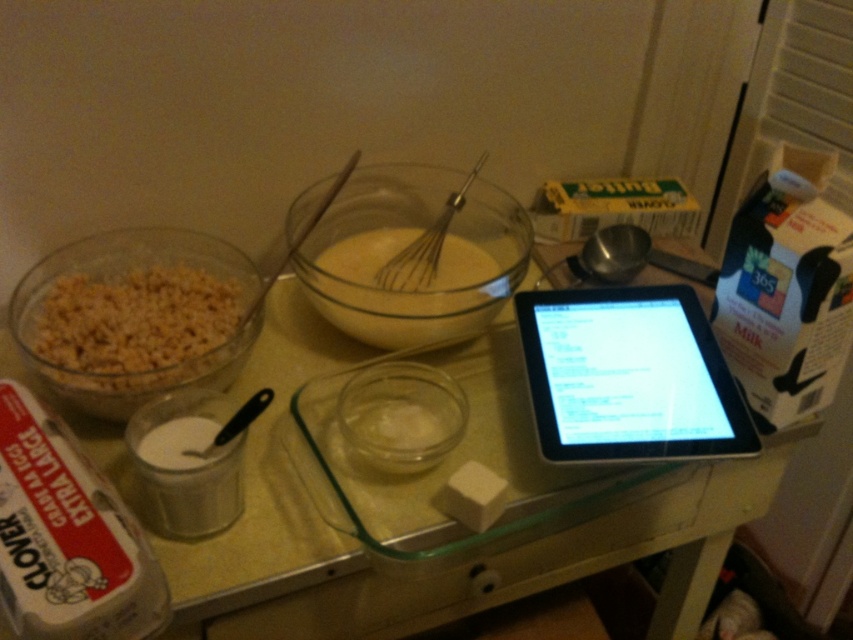
You are a chef preparing a recipe and need to pour the contents of the transparent glass bowl at center into the brown crunchy cereal at left. Can you do this without moving the bowl or the cereal?

The transparent glass bowl at center is to the right of brown crunchy cereal at left, so you can pour the contents from the transparent glass bowl at center into the brown crunchy cereal at left without moving either item since they are positioned side by side.

What are the coordinates of the black glossy tablet at upper right?

The black glossy tablet at upper right is located at point (628, 376).